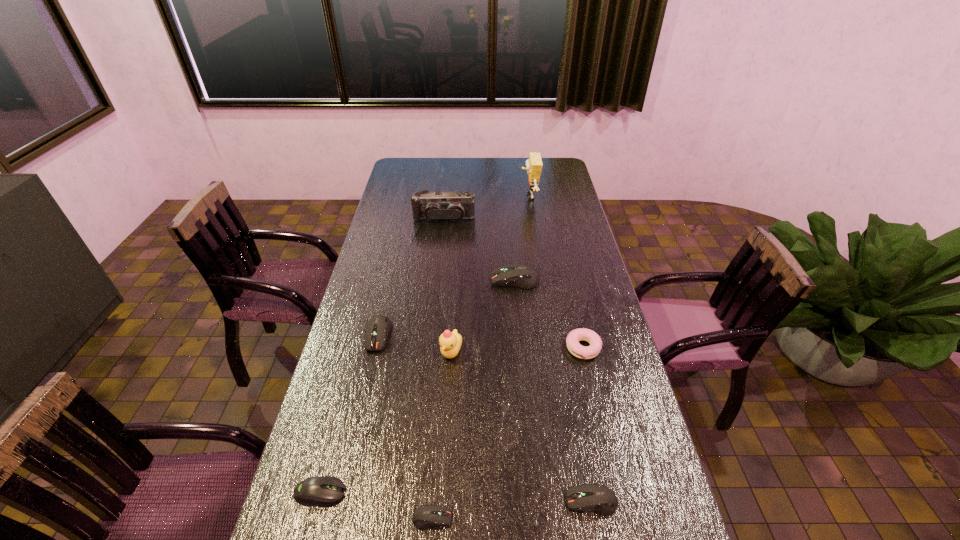
The height and width of the screenshot is (540, 960). I want to click on free area in between the yellow sponge and the third biggest dark computer equipment, so click(x=561, y=349).

The image size is (960, 540). In order to click on vacant area that lies between the second smallest dark computer equipment and the farthest object in this screenshot , I will do `click(561, 349)`.

This screenshot has height=540, width=960. I want to click on vacant area between the camcorder and the gray computer mouse, so click(382, 356).

Identify the location of object that is the third closest to the gray computer mouse. The width and height of the screenshot is (960, 540). (450, 342).

At what (x,y) coordinates should I click in order to perform the action: click on object that is the eighth closest to the second farthest object. Please return your answer as a coordinate pair (x, y). Looking at the image, I should click on (425, 516).

Where is `the fifth closest computer equipment to the pink doughnut`? This screenshot has height=540, width=960. the fifth closest computer equipment to the pink doughnut is located at coordinates (321, 490).

Identify which computer equipment is the fourth closest to the third tallest object. Please provide its 2D coordinates. Your answer should be formatted as a tuple, i.e. [(x, y)], where the tuple contains the x and y coordinates of a point satisfying the conditions above.

[(425, 516)]

Where is `dark computer equipment object that ranks as the closest to the farthest object`? dark computer equipment object that ranks as the closest to the farthest object is located at coordinates (514, 275).

Point out which dark computer equipment is positioned as the nearest to the farthest computer equipment. Please provide its 2D coordinates. Your answer should be formatted as a tuple, i.e. [(x, y)], where the tuple contains the x and y coordinates of a point satisfying the conditions above.

[(378, 327)]

At what (x,y) coordinates should I click in order to perform the action: click on vacant region that satisfies the following two spatial constraints: 1. on the front-facing side of the eighth nearest object; 2. on the wheel side of the gray computer mouse. Please return your answer as a coordinate pair (x, y). The image size is (960, 540). Looking at the image, I should click on (413, 492).